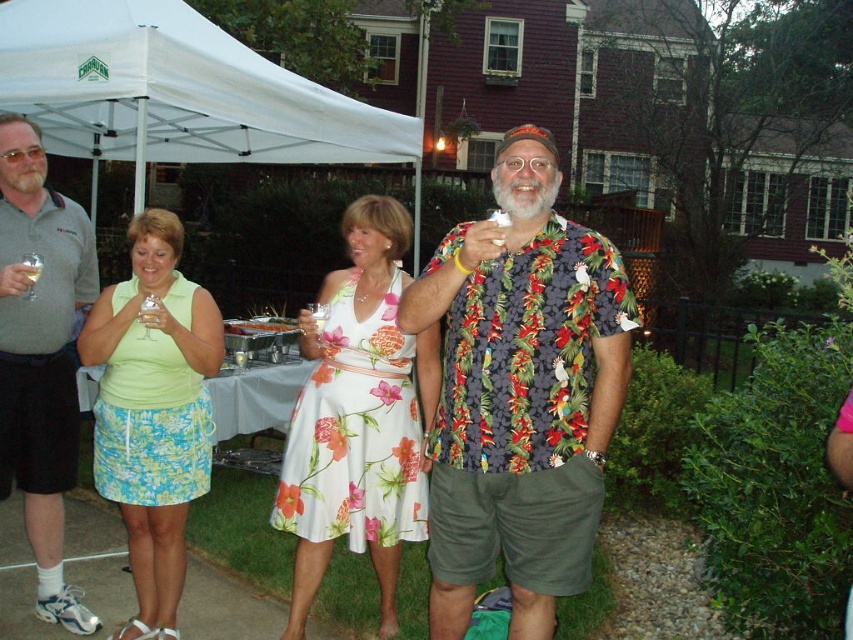
Describe the element at coordinates (520, 394) in the screenshot. I see `floral print shirt at center` at that location.

Does floral print shirt at center have a greater width compared to gray polo shirt at center?

Indeed, floral print shirt at center has a greater width compared to gray polo shirt at center.

Which is behind, point (596, 246) or point (77, 272)?

Positioned behind is point (77, 272).

Locate an element on the screen. floral print shirt at center is located at coordinates (520, 394).

Does lime green fabric skirt at left appear on the right side of translucent glass at center?

No, lime green fabric skirt at left is not to the right of translucent glass at center.

Can you confirm if lime green fabric skirt at left is positioned below translucent glass at center?

Yes.

Who is more forward, (138, 518) or (310, 320)?

Point (310, 320) is in front.

Where is `lime green fabric skirt at left`? Image resolution: width=853 pixels, height=640 pixels. lime green fabric skirt at left is located at coordinates (154, 412).

What do you see at coordinates (154, 412) in the screenshot?
I see `lime green fabric skirt at left` at bounding box center [154, 412].

Does point (146, 632) come farther from viewer compared to point (9, 388)?

No, it is in front of (9, 388).

Where is `lime green fabric skirt at left`? lime green fabric skirt at left is located at coordinates (154, 412).